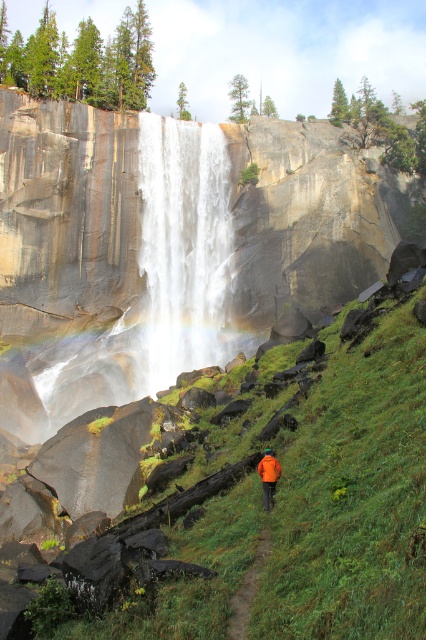
Based on the photo, you are standing at the base of the waterfall and want to reach a specific point marked at coordinates point (253, 589). If you can walk 100 feet in 2 minutes, how long will it take you to reach that point?

The distance of point (253, 589) from viewer is 67.74 feet. At a walking speed of 100 feet per 2 minutes, it would take approximately 1.35 minutes to reach the point.

You are a photographer standing at the base of the waterfall. You want to take a photo that includes both the white translucent water at center and the orange fabric jacket at center. Given that your camera has a maximum focus range of 150 feet, will you be able to capture both subjects in sharp focus?

The white translucent water at center and orange fabric jacket at center are 175.19 feet apart from each other. Since the maximum focus range of the camera is 150 feet, the distance between them exceeds this limit. Therefore, you cannot capture both subjects in sharp focus simultaneously.

You are a hiker standing at the edge of the green grassy trail at lower center and want to reach the orange fabric jacket at center. Which direction should you move to get closer to the jacket?

The orange fabric jacket at center is farther away from the viewer than the green grassy trail at lower center. To reach the jacket, you should move forward away from the trail towards the direction of the jacket.